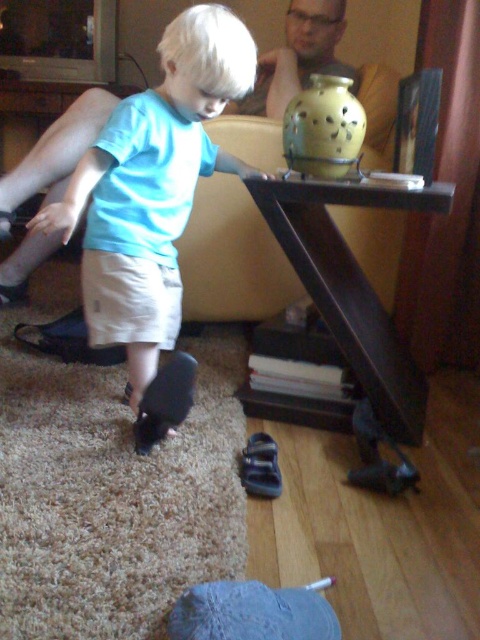
Question: Is matte black shoe at lower left positioned at the back of yellow matte vase at upper center?

Choices:
 (A) yes
 (B) no

Answer: (B)

Question: Does matte black shoe at lower left appear on the right side of yellow matte vase at upper center?

Choices:
 (A) no
 (B) yes

Answer: (A)

Question: Which point is farther to the camera?

Choices:
 (A) (216, 60)
 (B) (357, 156)

Answer: (B)

Question: Which of the following is the farthest from the observer?

Choices:
 (A) matte black laptop at upper left
 (B) yellow matte vase at upper center

Answer: (A)

Question: Which of the following is the farthest from the observer?

Choices:
 (A) (304, 156)
 (B) (158, 392)
 (C) (37, 163)

Answer: (C)

Question: Is matte black shoe at lower left below yellow matte vase at upper center?

Choices:
 (A) yes
 (B) no

Answer: (A)